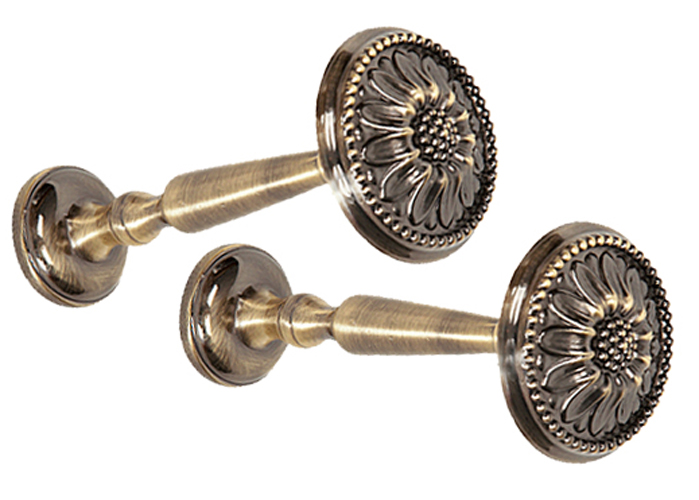
The width and height of the screenshot is (699, 500). In order to click on light reflections in this screenshot , I will do `click(47, 203)`, `click(47, 246)`, `click(222, 341)`, `click(212, 287)`.